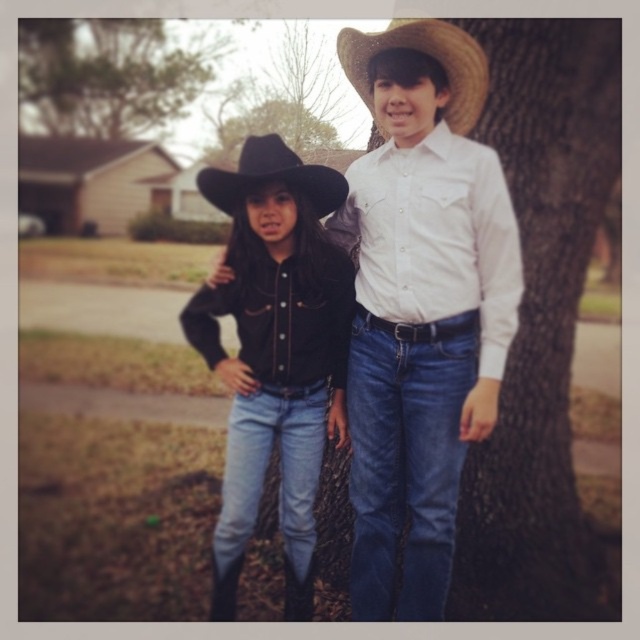
You are a photographer trying to capture both the green leafy tree at upper left and the black felt fedora at center in the same frame. Based on their sizes, which object should you focus on first to ensure both fit properly?

The green leafy tree at upper left has a lesser width compared to the black felt fedora at center. To ensure both fit properly, focus on the wider black felt fedora at center first, then adjust the frame to include the narrower tree.

You are a photographer trying to capture the black matte cowboy hat at center in your shot. Given that the camera is positioned at the point with coordinates point at (275, 352), can you confirm if the camera is directly facing the black matte cowboy hat at center?

The point at (275, 352) indicates the black matte cowboy hat at center, so yes, the camera is directly facing the black matte cowboy hat at center.